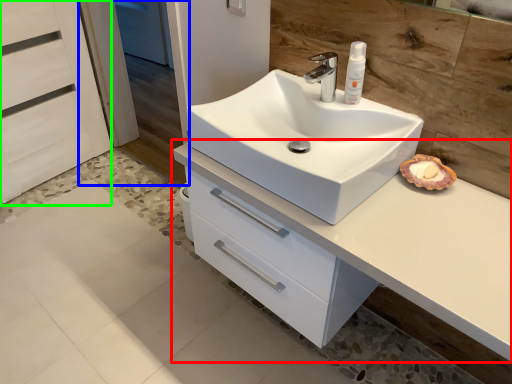
Question: Which object is the farthest from bathroom cabinet (highlighted by a red box)? Choose among these: screen door (highlighted by a blue box) or screen door (highlighted by a green box).

Choices:
 (A) screen door
 (B) screen door

Answer: (A)